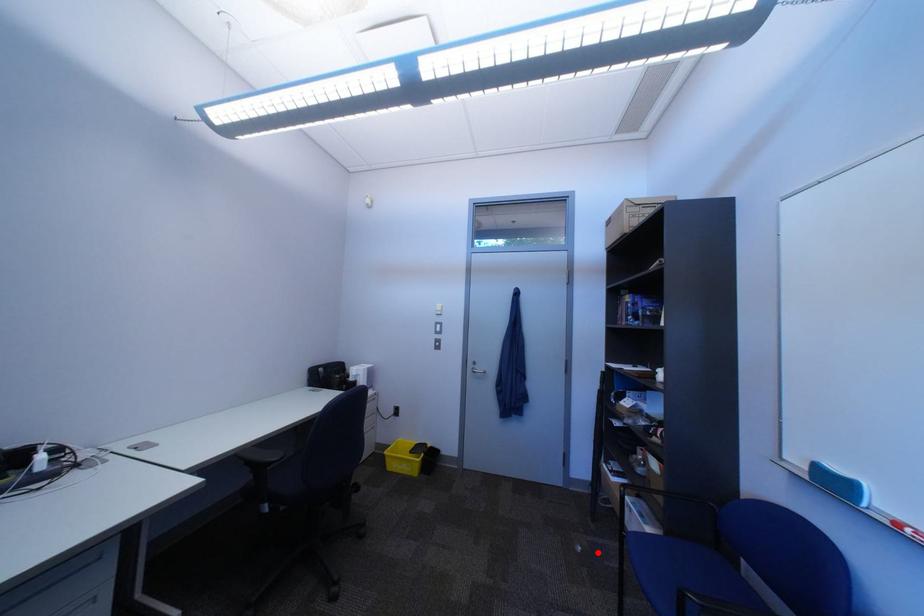
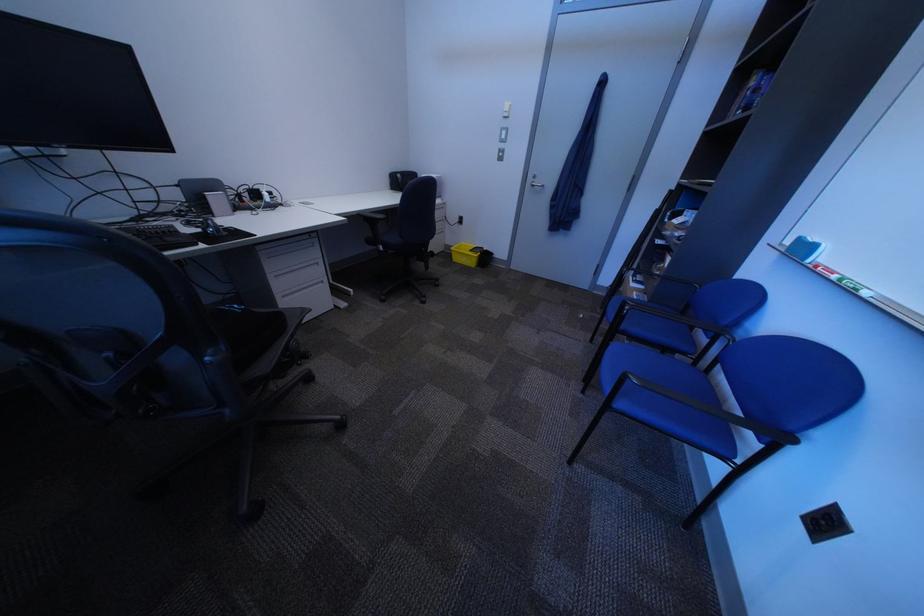
In the second image, find the point that corresponds to the highlighted location in the first image.

(599, 318)